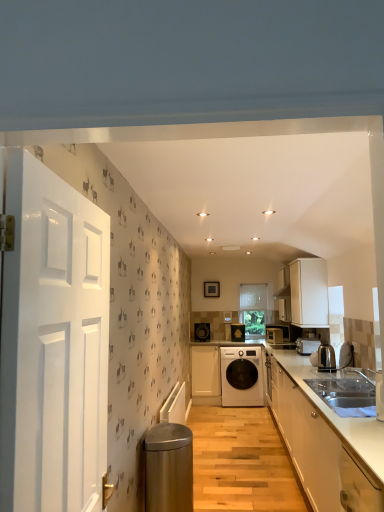
Question: Is white glossy cabinets at lower right, acting as the second cabinetry starting from the left, positioned far away from white glossy washing machine at center?

Choices:
 (A) no
 (B) yes

Answer: (B)

Question: Can you confirm if white glossy cabinets at lower right, which is the 3th cabinetry in back-to-front order, is positioned to the right of white glossy washing machine at center?

Choices:
 (A) no
 (B) yes

Answer: (B)

Question: Would you say white glossy washing machine at center is part of white glossy cabinets at lower right, which is the 3th cabinetry in back-to-front order,'s contents?

Choices:
 (A) no
 (B) yes

Answer: (A)

Question: From a real-world perspective, is white glossy cabinets at lower right, which is the 3th cabinetry in back-to-front order, below white glossy washing machine at center?

Choices:
 (A) no
 (B) yes

Answer: (A)

Question: Considering the relative sizes of white glossy cabinets at lower right, acting as the second cabinetry starting from the left, and white glossy washing machine at center in the image provided, is white glossy cabinets at lower right, acting as the second cabinetry starting from the left, shorter than white glossy washing machine at center?

Choices:
 (A) no
 (B) yes

Answer: (A)

Question: From a real-world perspective, is matte black speaker at center, the first appliance when ordered from left to right, physically located above or below white glossy cabinets at lower right, acting as the second cabinetry starting from the left?

Choices:
 (A) below
 (B) above

Answer: (B)

Question: Choose the correct answer: Is matte black speaker at center, the first appliance when ordered from left to right, inside white glossy cabinets at lower right, acting as the second cabinetry starting from the left, or outside it?

Choices:
 (A) outside
 (B) inside

Answer: (A)

Question: Based on their sizes in the image, would you say matte black speaker at center, the first appliance when ordered from left to right, is bigger or smaller than white glossy cabinets at lower right, acting as the second cabinetry starting from the left?

Choices:
 (A) big
 (B) small

Answer: (B)

Question: In the image, is matte black speaker at center, arranged as the third appliance when viewed from the right, positioned in front of or behind white glossy cabinets at lower right, which is the 3th cabinetry in back-to-front order?

Choices:
 (A) front
 (B) behind

Answer: (B)

Question: From the image's perspective, relative to white matte cabinet at center, the first cabinetry positioned from the back, is white matte cabinet at upper right, marked as the 2th cabinetry in a front-to-back arrangement, above or below?

Choices:
 (A) above
 (B) below

Answer: (A)

Question: Is point (296, 286) positioned closer to the camera than point (211, 361)?

Choices:
 (A) closer
 (B) farther

Answer: (A)

Question: Considering the positions of white matte cabinet at upper right, the 1th cabinetry when ordered from right to left, and white matte cabinet at center, placed as the 1th cabinetry when sorted from left to right, in the image, is white matte cabinet at upper right, the 1th cabinetry when ordered from right to left, wider or thinner than white matte cabinet at center, placed as the 1th cabinetry when sorted from left to right,?

Choices:
 (A) wide
 (B) thin

Answer: (B)

Question: From a real-world perspective, is white matte cabinet at upper right, the 1th cabinetry when ordered from right to left, above or below white matte cabinet at center, the first cabinetry positioned from the back?

Choices:
 (A) below
 (B) above

Answer: (B)

Question: Is white glossy washing machine at center to the left or to the right of matte black microwave at center, the first kitchen appliance from the back, in the image?

Choices:
 (A) left
 (B) right

Answer: (A)

Question: From a real-world perspective, relative to matte black microwave at center, the first kitchen appliance from the back, is white glossy washing machine at center vertically above or below?

Choices:
 (A) above
 (B) below

Answer: (B)